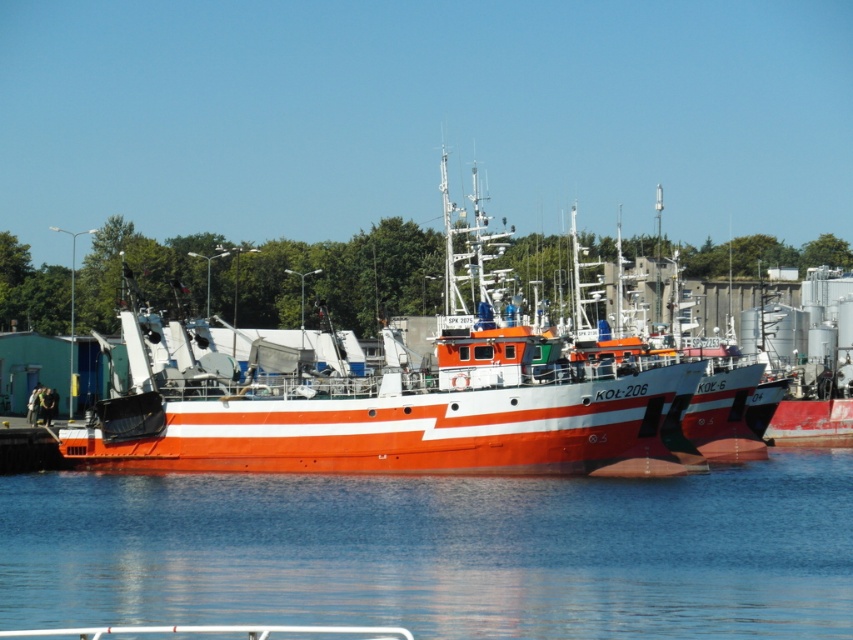
Question: Can you confirm if transparent water at center is positioned below orange glossy boat at center?

Choices:
 (A) no
 (B) yes

Answer: (B)

Question: Does transparent water at center appear over orange glossy boat at center?

Choices:
 (A) no
 (B) yes

Answer: (A)

Question: Among these points, which one is nearest to the camera?

Choices:
 (A) (135, 445)
 (B) (421, 602)

Answer: (B)

Question: Is transparent water at center smaller than orange glossy boat at center?

Choices:
 (A) no
 (B) yes

Answer: (B)